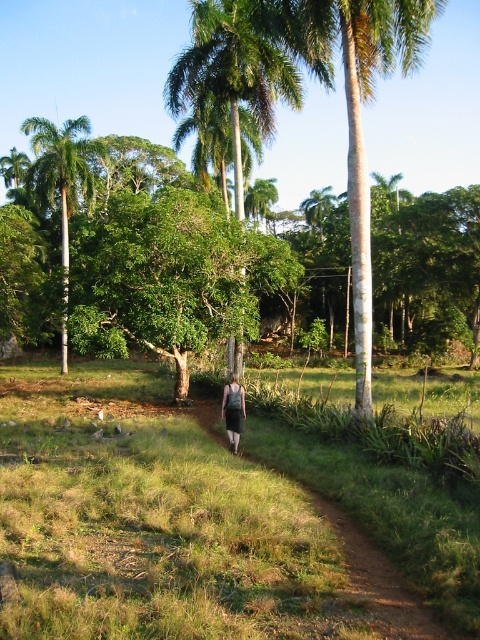
Question: Among these points, which one is nearest to the camera?

Choices:
 (A) (84, 124)
 (B) (228, 387)
 (C) (12, 509)
 (D) (254, 108)

Answer: (C)

Question: Which point is farther to the camera?

Choices:
 (A) (123, 460)
 (B) (231, 52)

Answer: (B)

Question: Does green leafy palm tree at left come in front of gray fabric skirt at center?

Choices:
 (A) no
 (B) yes

Answer: (A)

Question: Estimate the real-world distances between objects in this image. Which object is closer to the green leafy palm tree at left?

Choices:
 (A) green leafy palm tree at center
 (B) gray fabric skirt at center

Answer: (A)

Question: Can you confirm if green grass at center is wider than green leafy palm tree at left?

Choices:
 (A) yes
 (B) no

Answer: (A)

Question: Is the position of green leafy palm tree at left more distant than that of gray fabric skirt at center?

Choices:
 (A) no
 (B) yes

Answer: (B)